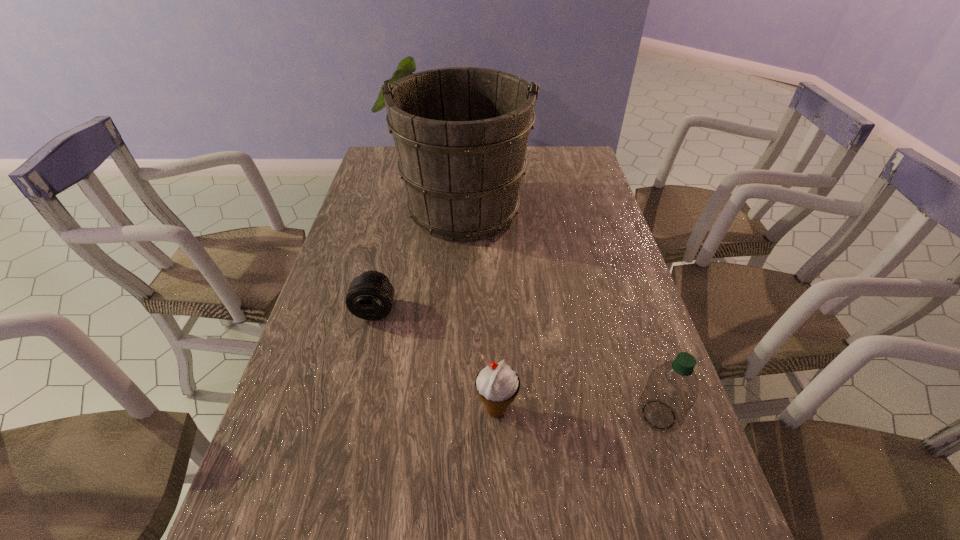
This screenshot has width=960, height=540. Find the location of `the second closest object relative to the telephoto lens`. the second closest object relative to the telephoto lens is located at coordinates (497, 384).

This screenshot has width=960, height=540. In order to click on vacant position in the image that satisfies the following two spatial constraints: 1. on the front side of the water bottle; 2. on the right side of the third tallest object in this screenshot , I will do `click(496, 415)`.